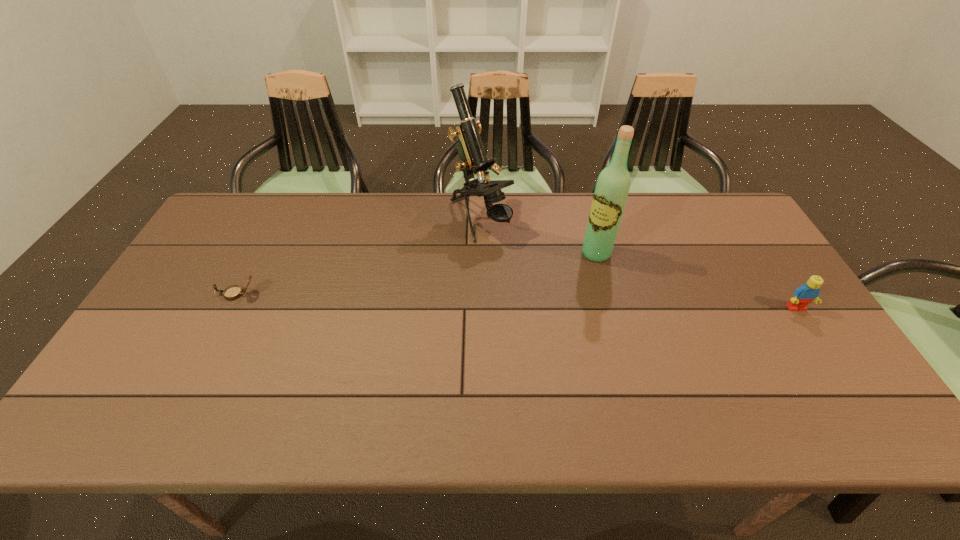
The image size is (960, 540). I want to click on free space between the nearest object and the third object from left to right, so click(696, 281).

Identify the location of vacant space in between the leftmost object and the nearest object. Image resolution: width=960 pixels, height=540 pixels. (516, 301).

You are a GUI agent. You are given a task and a screenshot of the screen. Output one action in this format:
    pyautogui.click(x=<x>, y=<y>)
    Task: Click on the vacant space that's between the compass and the Lego
    
    Given the screenshot: What is the action you would take?
    pyautogui.click(x=516, y=301)

Identify the location of free point between the third tallest object and the second object from right to left. (696, 281).

Locate an element on the screen. vacant area that lies between the third tallest object and the compass is located at coordinates (516, 301).

The width and height of the screenshot is (960, 540). What are the coordinates of `the third closest object to the compass` in the screenshot? It's located at (803, 295).

Choose which object is the third nearest neighbor to the third object from left to right. Please provide its 2D coordinates. Your answer should be formatted as a tuple, i.e. [(x, y)], where the tuple contains the x and y coordinates of a point satisfying the conditions above.

[(232, 292)]